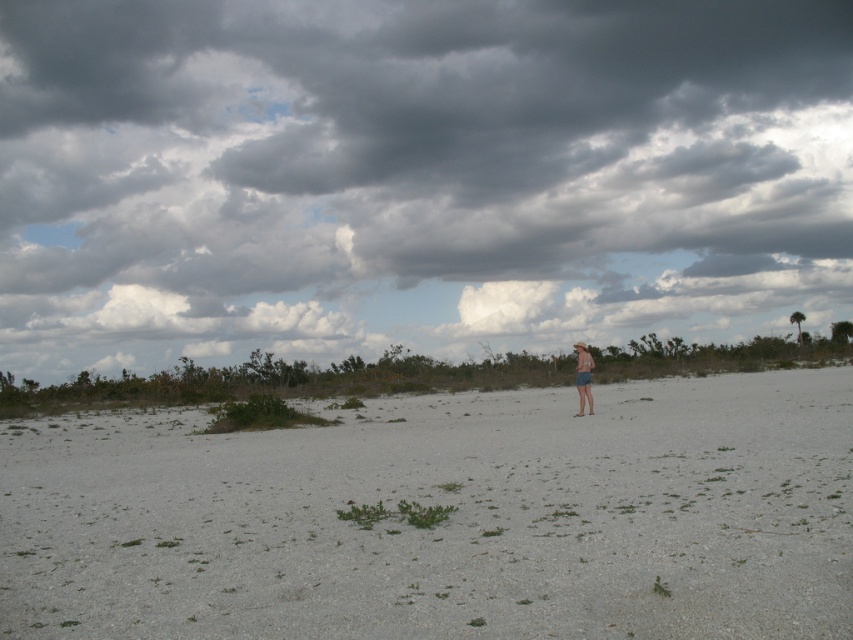
You are standing at the point marked by the coordinates point (445, 518). Looking around, what is the color of the ground beneath your feet?

The white sand at center is located at point (445, 518), so the ground beneath your feet is white sand.

You are standing at point (x=589, y=400) and want to walk to the shrubs in the background. Is the point (x=387, y=264) in front of or behind you relative to your direction of travel?

Point (x=387, y=264) is behind point (x=589, y=400), so it would be behind you as you walk towards the shrubs in the background.